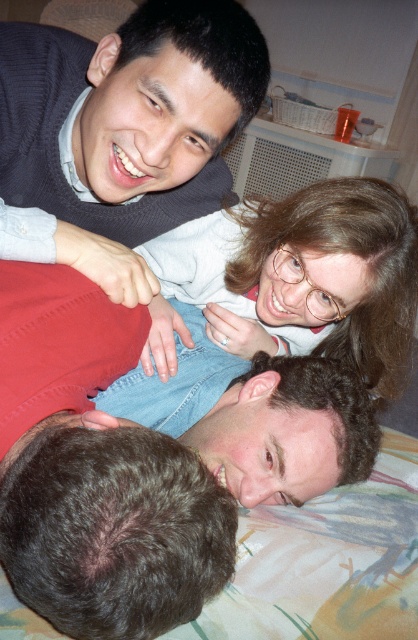
Question: Considering the real-world distances, which object is farthest from the dark brown hair at lower left?

Choices:
 (A) matte gray sweater at upper left
 (B) matte blue jeans at upper center

Answer: (B)

Question: Which point appears farthest from the camera in this image?

Choices:
 (A) (244, 17)
 (B) (76, 493)

Answer: (A)

Question: Does matte blue jeans at upper center appear over matte gray sweater at upper left?

Choices:
 (A) yes
 (B) no

Answer: (B)

Question: Does dark brown hair at lower left appear over matte gray sweater at upper left?

Choices:
 (A) yes
 (B) no

Answer: (B)

Question: Does dark brown hair at lower left have a lesser width compared to matte blue jeans at upper center?

Choices:
 (A) no
 (B) yes

Answer: (B)

Question: Which point appears closest to the camera in this image?

Choices:
 (A) (10, 196)
 (B) (336, 188)

Answer: (B)